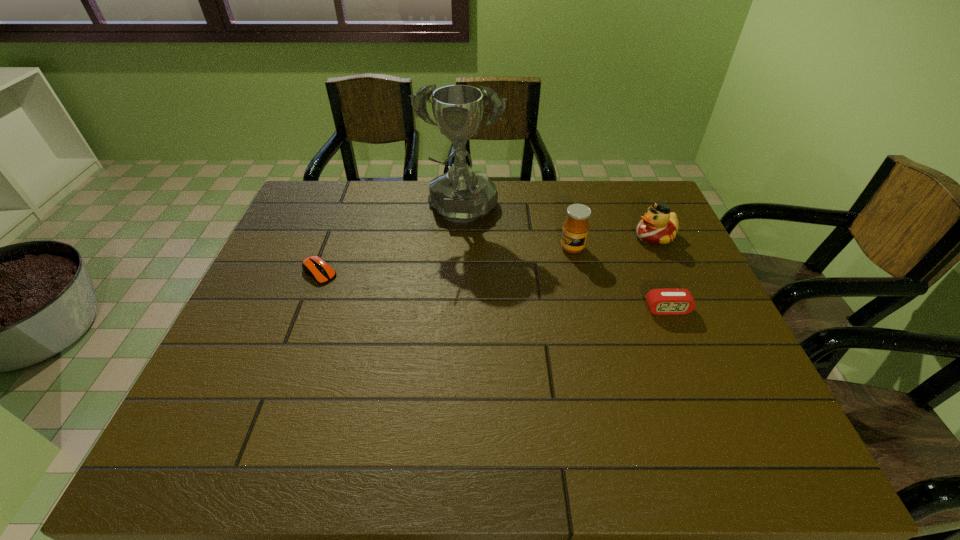
The image size is (960, 540). I want to click on free space located 0.060m on the front-facing side of the honey, so click(x=548, y=261).

Find the location of a particular element. This screenshot has width=960, height=540. free region located on the front-facing side of the honey is located at coordinates (457, 310).

This screenshot has height=540, width=960. I want to click on blank space located 0.130m on the front-facing side of the honey, so click(x=529, y=271).

Identify the location of vacant space located 0.140m on the side with emblem of the tallest object. (450, 270).

Where is `free space located on the side with emblem of the tallest object`? The width and height of the screenshot is (960, 540). free space located on the side with emblem of the tallest object is located at coordinates tap(448, 280).

This screenshot has height=540, width=960. I want to click on vacant region located on the side with emblem of the tallest object, so click(x=439, y=329).

Locate an element on the screen. Image resolution: width=960 pixels, height=540 pixels. free space located 0.270m on the face of the duck is located at coordinates (561, 269).

Image resolution: width=960 pixels, height=540 pixels. In order to click on vacant position located on the face of the duck in this screenshot , I will do `click(529, 280)`.

Identify the location of blank space located on the face of the duck. Image resolution: width=960 pixels, height=540 pixels. (554, 271).

Where is `object that is at the far edge`? The width and height of the screenshot is (960, 540). object that is at the far edge is located at coordinates (460, 195).